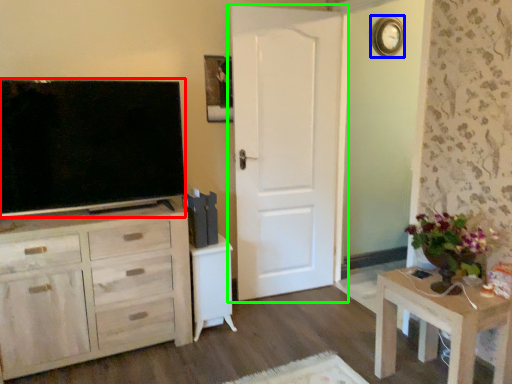
Question: Based on their relative distances, which object is nearer to television (highlighted by a red box)? Choose from clock (highlighted by a blue box) and door (highlighted by a green box).

Choices:
 (A) clock
 (B) door

Answer: (B)